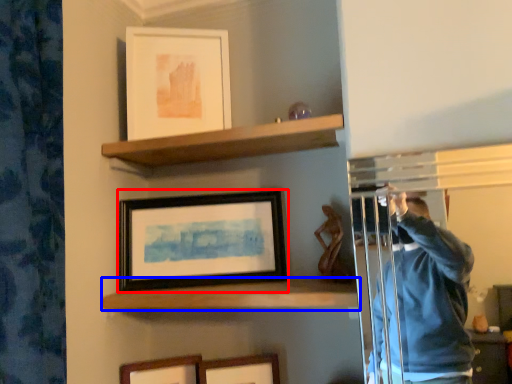
Question: Which object is further to the camera taking this photo, picture frame (highlighted by a red box) or shelf (highlighted by a blue box)?

Choices:
 (A) picture frame
 (B) shelf

Answer: (A)